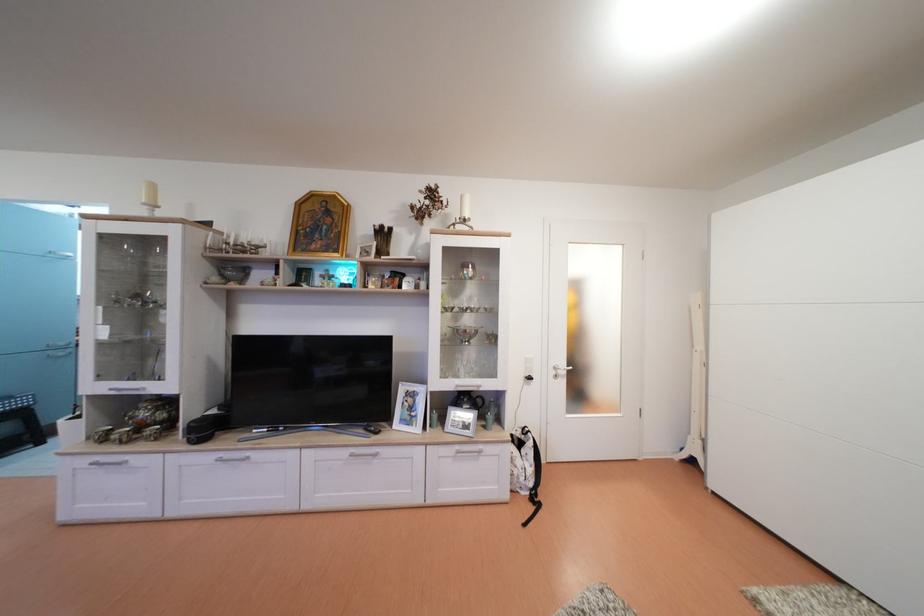
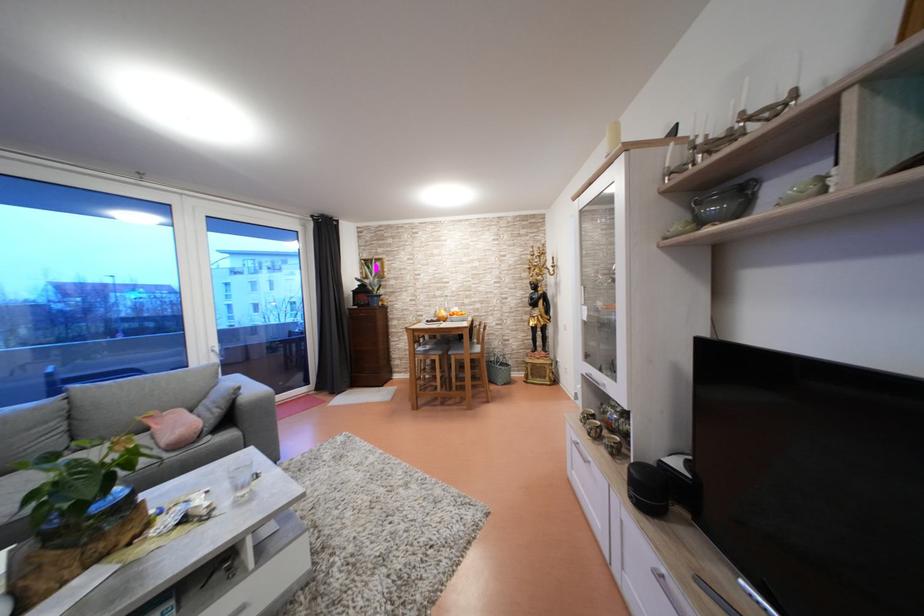
Where in the second image is the point corresponding to point (214, 436) from the first image?

(662, 500)